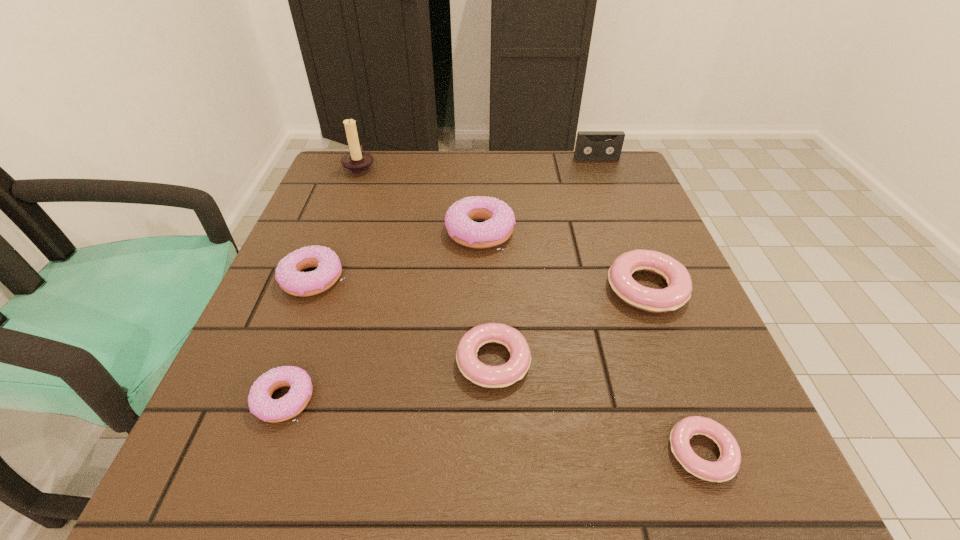
Identify the location of free space in the image that satisfies the following two spatial constraints: 1. on the back side of the smallest purple doughnut; 2. on the wick of the brown candle holder. The image size is (960, 540). (368, 166).

At what (x,y) coordinates should I click in order to perform the action: click on blank area in the image that satisfies the following two spatial constraints: 1. on the wick of the candle holder; 2. on the right side of the farthest pink doughnut. Please return your answer as a coordinate pair (x, y). Looking at the image, I should click on (313, 289).

Locate an element on the screen. free space in the image that satisfies the following two spatial constraints: 1. on the front-facing side of the videotape; 2. on the wick of the candle holder is located at coordinates (599, 166).

What are the coordinates of `free point that satisfies the following two spatial constraints: 1. on the back side of the biggest pink doughnut; 2. on the wick of the tallest object` in the screenshot? It's located at (600, 166).

Where is `vacant position in the image that satisfies the following two spatial constraints: 1. on the front side of the leftmost pink doughnut; 2. on the right side of the second biggest purple doughnut`? vacant position in the image that satisfies the following two spatial constraints: 1. on the front side of the leftmost pink doughnut; 2. on the right side of the second biggest purple doughnut is located at coordinates (282, 361).

The width and height of the screenshot is (960, 540). In order to click on free point that satisfies the following two spatial constraints: 1. on the front-facing side of the second tallest object; 2. on the right side of the biggest pink doughnut in this screenshot , I will do `click(646, 289)`.

The width and height of the screenshot is (960, 540). I want to click on vacant region that satisfies the following two spatial constraints: 1. on the wick of the biggest pink doughnut; 2. on the right side of the candle holder, so click(x=313, y=289).

In order to click on vacant space that satisfies the following two spatial constraints: 1. on the front side of the shortest object; 2. on the left side of the nearest purple doughnut in this screenshot , I will do `click(266, 453)`.